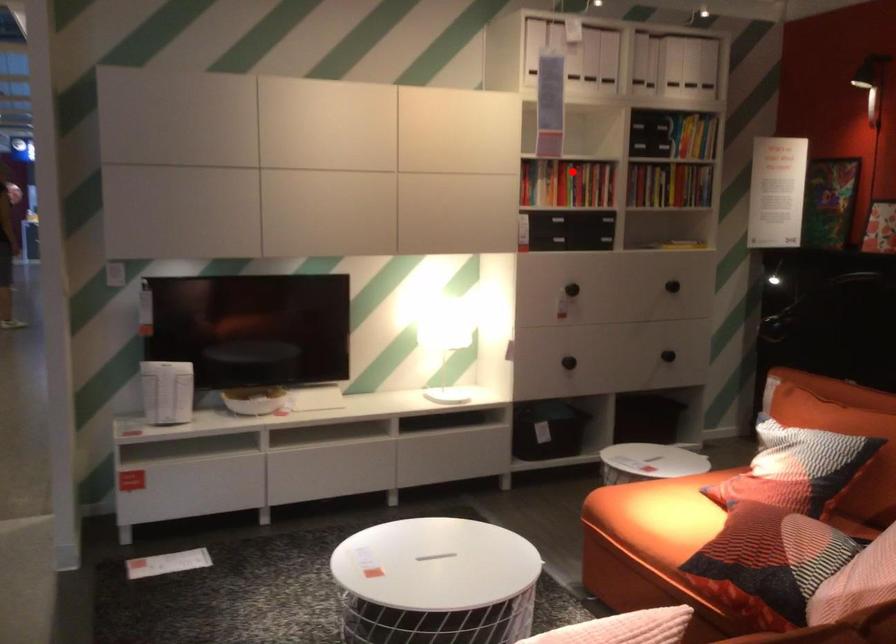
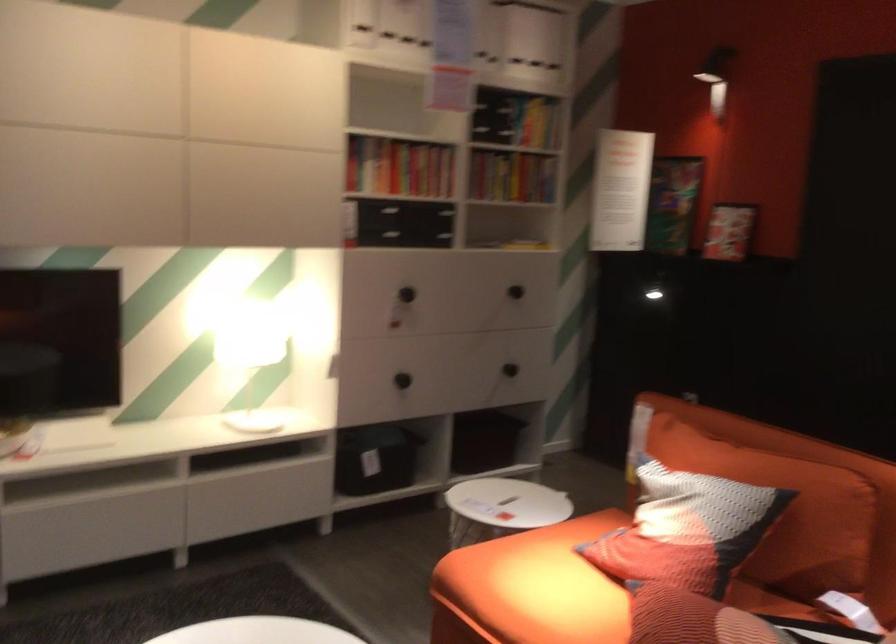
Question: I am providing you with two images of the same scene from different viewpoints. A red point is marked on the first image. Can you still see the location of the red point in image 2?

Choices:
 (A) Yes
 (B) No

Answer: (A)